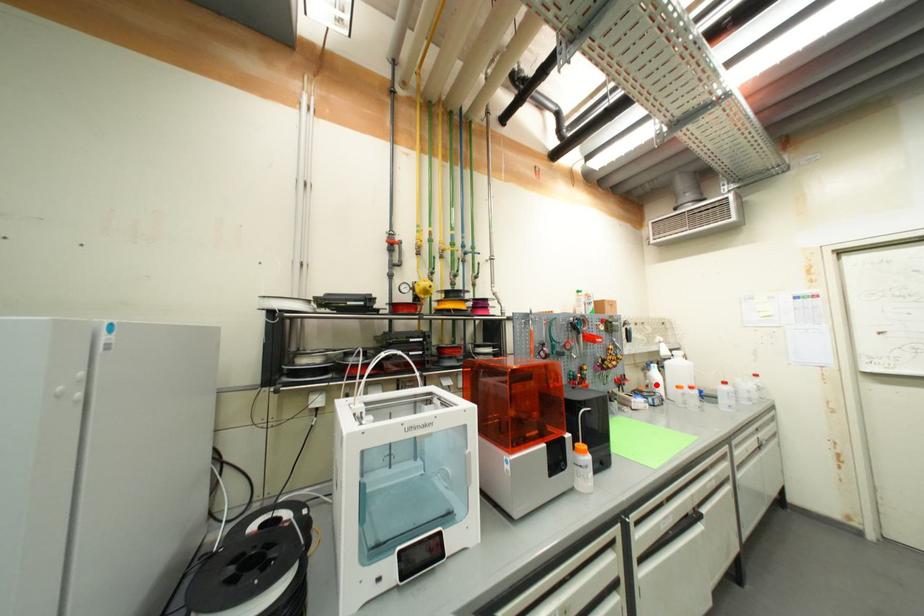
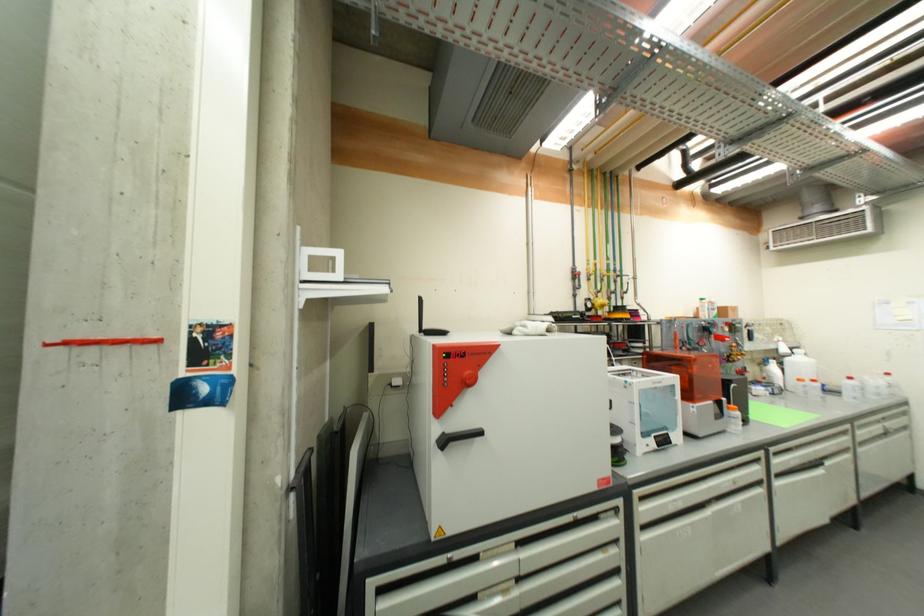
In the second image, find the point that corresponds to the highlighted location in the first image.

(774, 378)